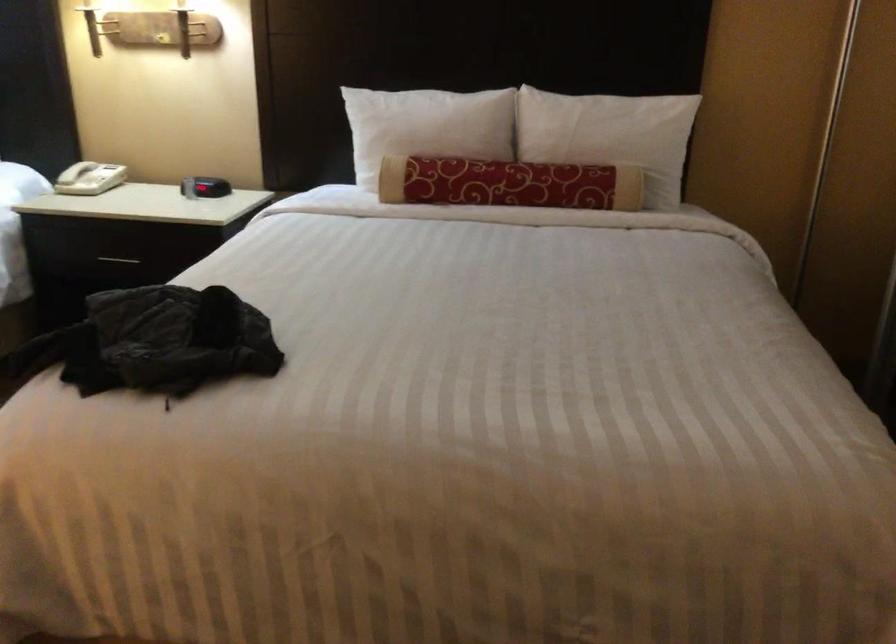
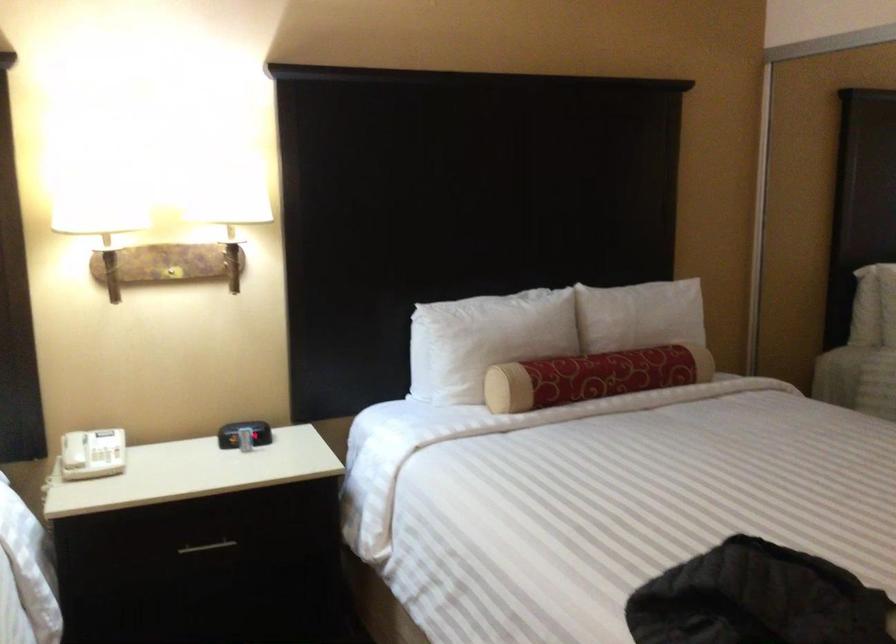
In the second image, find the point that corresponds to (391,129) in the first image.

(485, 339)